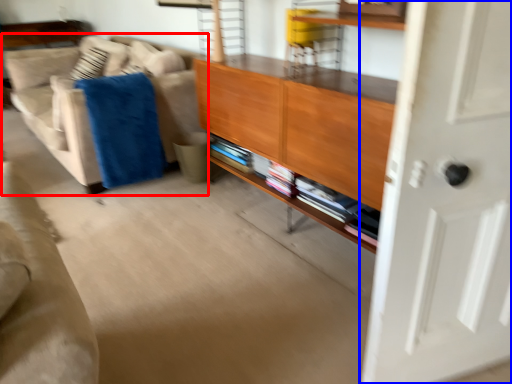
Question: Which object appears farthest to the camera in this image, studio couch (highlighted by a red box) or door (highlighted by a blue box)?

Choices:
 (A) studio couch
 (B) door

Answer: (A)